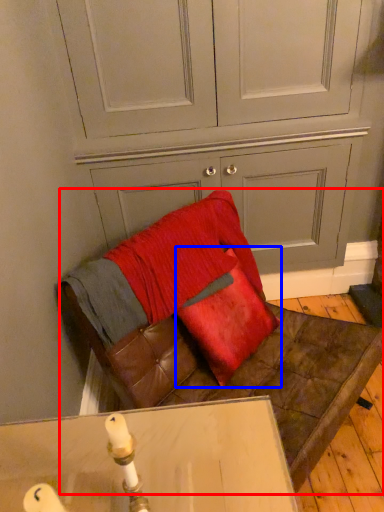
Question: Which point is further to the camera, furniture (highlighted by a red box) or throw pillow (highlighted by a blue box)?

Choices:
 (A) furniture
 (B) throw pillow

Answer: (B)